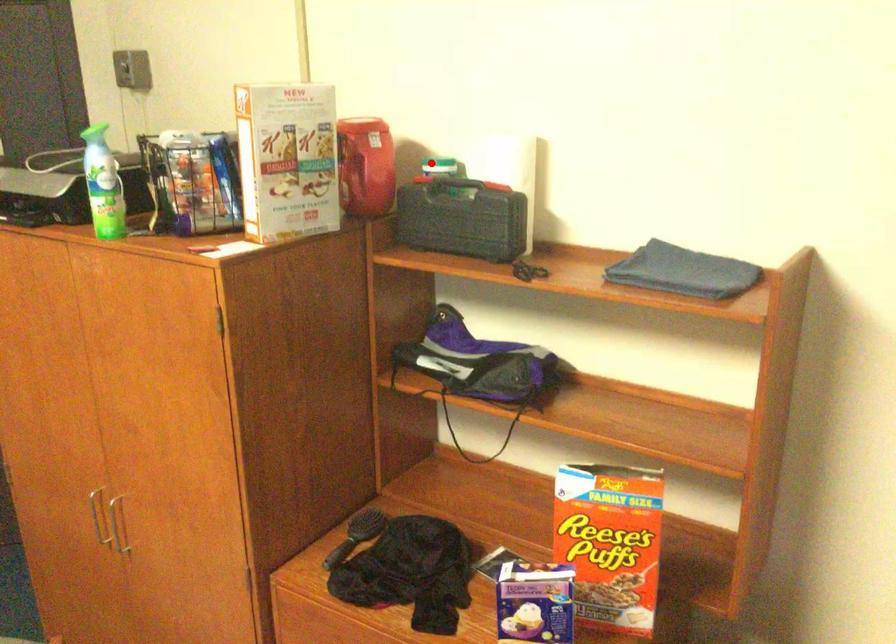
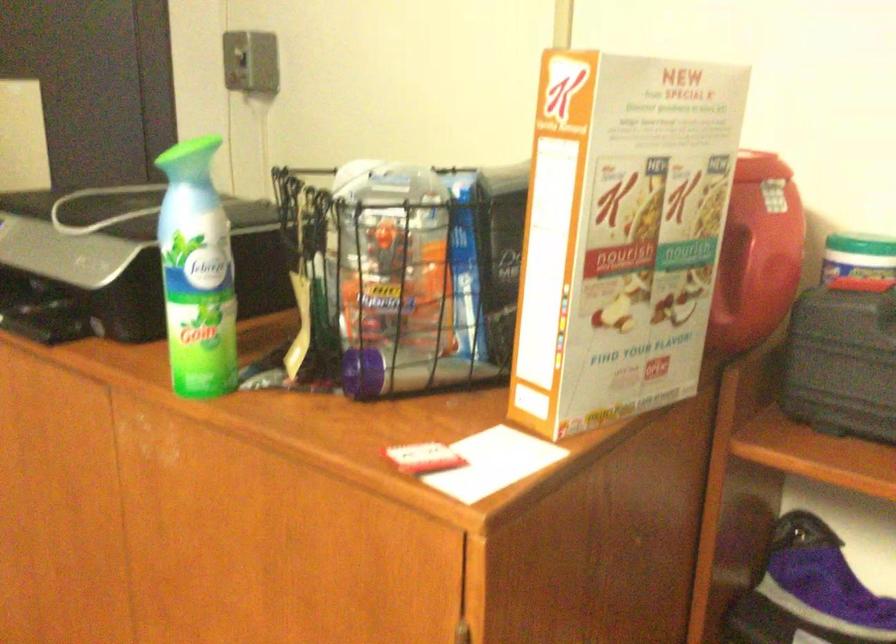
Find the pixel in the second image that matches the highlighted location in the first image.

(862, 249)